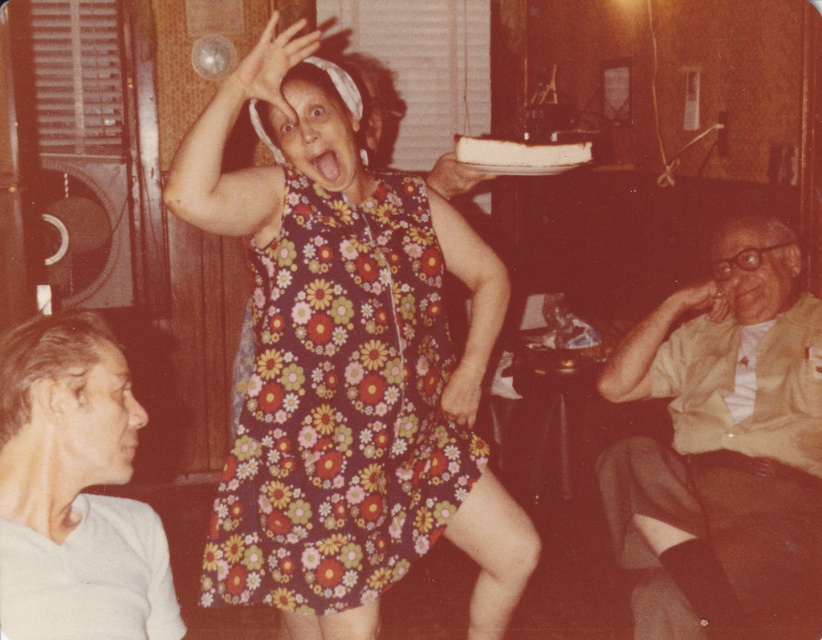
Question: Among these objects, which one is nearest to the camera?

Choices:
 (A) white matte shirt at lower left
 (B) light beige shirt at right

Answer: (A)

Question: Which is nearer to the floral-patterned fabric dress at center?

Choices:
 (A) white matte shirt at lower left
 (B) light beige shirt at right

Answer: (A)

Question: Among these objects, which one is farthest from the camera?

Choices:
 (A) light beige shirt at right
 (B) floral-patterned fabric dress at center
 (C) white matte shirt at lower left

Answer: (A)

Question: Where is light beige shirt at right located in relation to white matte shirt at lower left in the image?

Choices:
 (A) above
 (B) below

Answer: (B)

Question: Is light beige shirt at right thinner than white matte shirt at lower left?

Choices:
 (A) yes
 (B) no

Answer: (B)

Question: Does floral-patterned fabric dress at center come in front of white matte shirt at lower left?

Choices:
 (A) no
 (B) yes

Answer: (A)